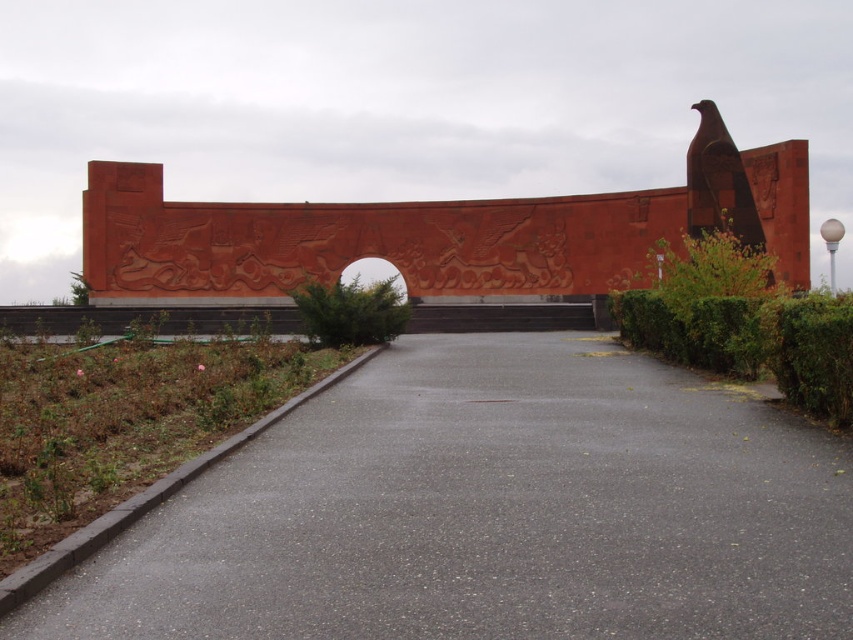
You are a gardener planning to trim the green leafy hedge at right. To avoid damaging the gray asphalt pavement at center, which direction should you move the hedge away from the pavement?

The gray asphalt pavement at center is located below the green leafy hedge at right, so you should move the hedge away from the pavement by directing it upward to prevent damage.